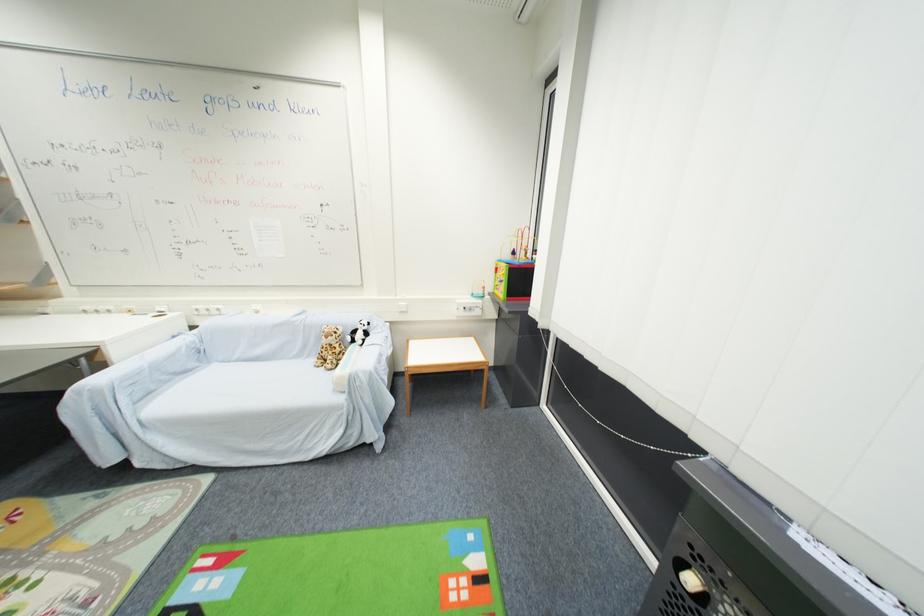
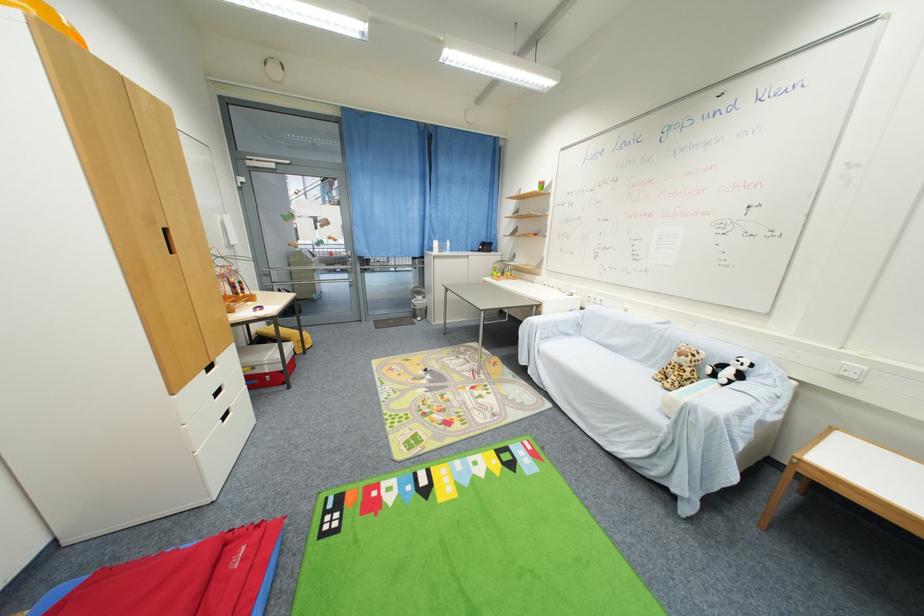
Locate, in the second image, the point that corresponds to [140,413] in the first image.

(543, 345)